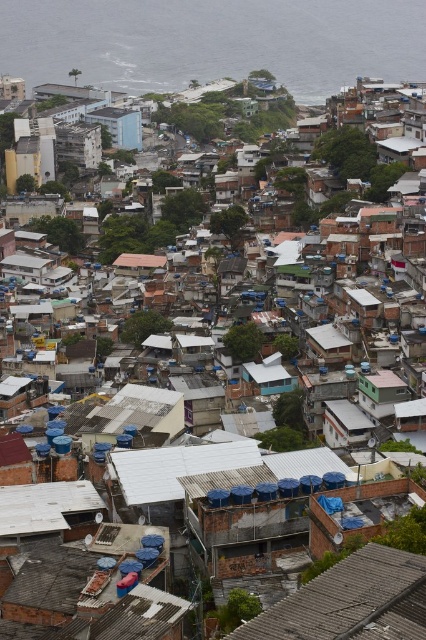
Which is more to the right, blue water at upper center or light blue concrete building at upper center?

blue water at upper center is more to the right.

Does point (161, 35) come in front of point (126, 113)?

No, it is not.

Does point (417, 67) lie in front of point (120, 136)?

No, it is behind (120, 136).

Identify the location of blue water at upper center. The image size is (426, 640). (213, 42).

Is blue water at upper center closer to the viewer compared to rusty corrugated metal roof at center?

No.

What do you see at coordinates (213, 42) in the screenshot? This screenshot has width=426, height=640. I see `blue water at upper center` at bounding box center [213, 42].

Where is `blue water at upper center`? Image resolution: width=426 pixels, height=640 pixels. blue water at upper center is located at coordinates (213, 42).

Is rusty corrugated metal roof at center to the right of light blue concrete building at upper center from the viewer's perspective?

Correct, you'll find rusty corrugated metal roof at center to the right of light blue concrete building at upper center.

Who is shorter, rusty corrugated metal roof at center or light blue concrete building at upper center?

rusty corrugated metal roof at center is shorter.

Identify the location of rusty corrugated metal roof at center. The width and height of the screenshot is (426, 640). (351, 602).